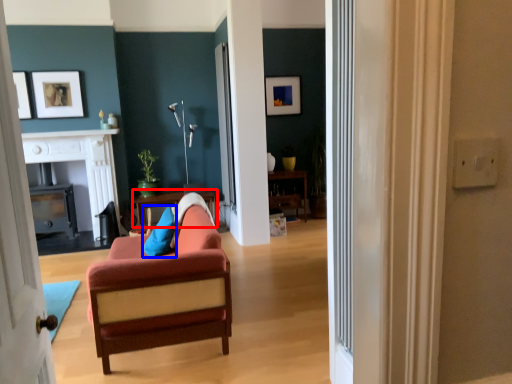
Question: Which of the following is the closest to the observer, table (highlighted by a red box) or pillow (highlighted by a blue box)?

Choices:
 (A) table
 (B) pillow

Answer: (B)